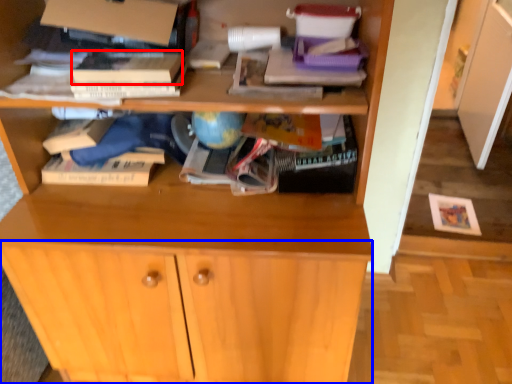
Question: Which of the following is the farthest to the observer, paperback book (highlighted by a red box) or cabinetry (highlighted by a blue box)?

Choices:
 (A) paperback book
 (B) cabinetry

Answer: (B)